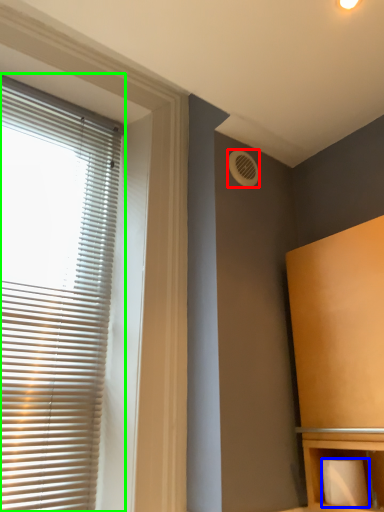
Question: Considering the real-world distances, which object is closest to air conditioning (highlighted by a red box)? toilet paper (highlighted by a blue box) or window blind (highlighted by a green box).

Choices:
 (A) toilet paper
 (B) window blind

Answer: (B)